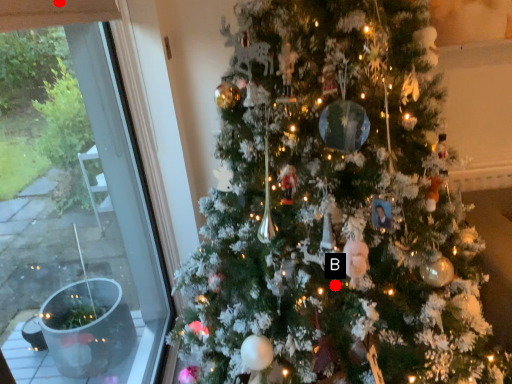
Question: Two points are circled on the image, labeled by A and B beside each circle. Which point appears farthest from the camera in this image?

Choices:
 (A) A is further
 (B) B is further

Answer: (B)